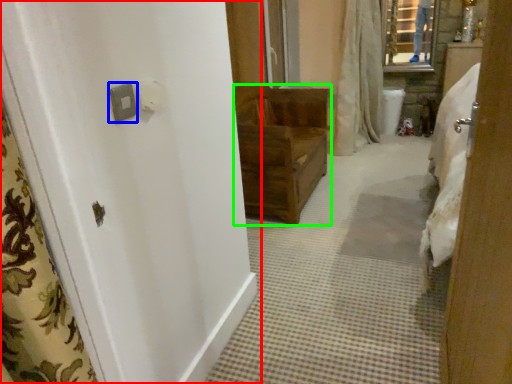
Question: Which is nearer to the door (highlighted by a red box)? light switch (highlighted by a blue box) or furniture (highlighted by a green box).

Choices:
 (A) light switch
 (B) furniture

Answer: (A)